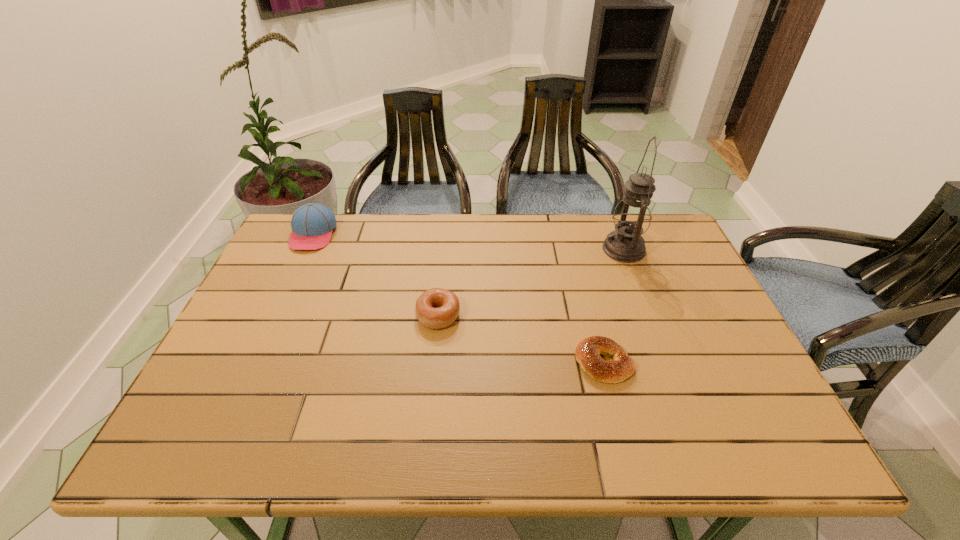
Where is `the rightmost object`? Image resolution: width=960 pixels, height=540 pixels. the rightmost object is located at coordinates (632, 216).

At what (x,y) coordinates should I click in order to perform the action: click on oil lamp. Please return your answer as a coordinate pair (x, y). Looking at the image, I should click on (632, 216).

Find the location of a particular element. This screenshot has height=540, width=960. the leftmost object is located at coordinates (312, 224).

Image resolution: width=960 pixels, height=540 pixels. Identify the location of the third shortest object. (312, 224).

Identify the location of the taller bagel. The image size is (960, 540). (436, 308).

Image resolution: width=960 pixels, height=540 pixels. Identify the location of the second object from left to right. (436, 308).

You are a GUI agent. You are given a task and a screenshot of the screen. Output one action in this format:
    pyautogui.click(x=<x>, y=<y>)
    Task: Click on the nearer bagel
    This screenshot has height=540, width=960.
    Given the screenshot: What is the action you would take?
    pyautogui.click(x=588, y=351)

Find the location of a particular element. the nearest object is located at coordinates (588, 351).

Identify the location of free point located on the left of the rightmost object. (513, 249).

At what (x,y) coordinates should I click in order to perform the action: click on free space located 0.210m on the front-facing side of the baseball cap. Please return your answer as a coordinate pair (x, y). The image size is (960, 540). Looking at the image, I should click on (282, 301).